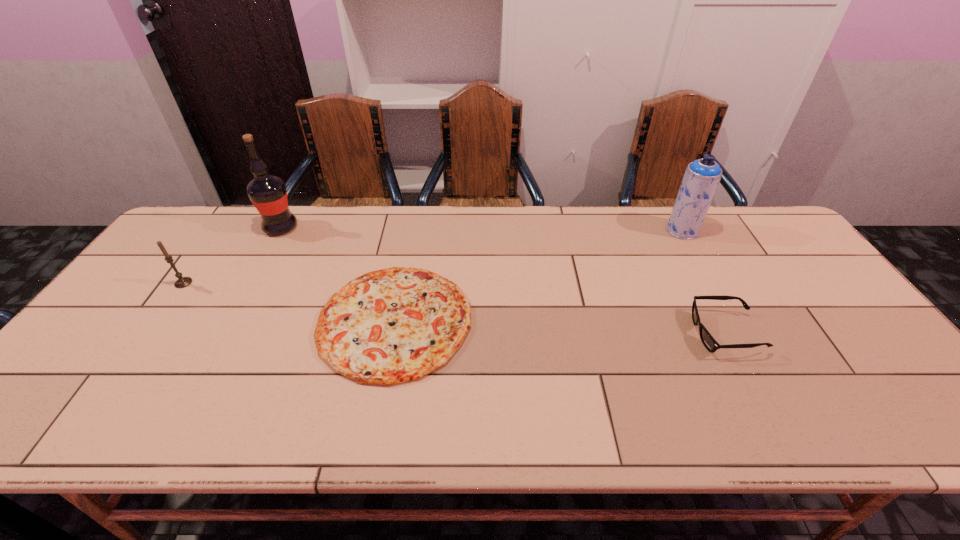
Where is `empty space that is in between the aerosol can and the sunglasses`? This screenshot has width=960, height=540. empty space that is in between the aerosol can and the sunglasses is located at coordinates (704, 282).

Where is `blank region between the tallest object and the fourth shortest object`? The image size is (960, 540). blank region between the tallest object and the fourth shortest object is located at coordinates (481, 229).

At what (x,y) coordinates should I click in order to perform the action: click on empty space that is in between the sunglasses and the aerosol can. Please return your answer as a coordinate pair (x, y). Looking at the image, I should click on (704, 282).

You are a GUI agent. You are given a task and a screenshot of the screen. Output one action in this format:
    pyautogui.click(x=<x>, y=<y>)
    Task: Click on the object that stands as the closest to the tallest object
    Image resolution: width=960 pixels, height=540 pixels.
    Given the screenshot: What is the action you would take?
    pyautogui.click(x=182, y=282)

Choose which object is the third nearest neighbor to the leftmost object. Please provide its 2D coordinates. Your answer should be formatted as a tuple, i.e. [(x, y)], where the tuple contains the x and y coordinates of a point satisfying the conditions above.

[(709, 342)]

The image size is (960, 540). Find the location of `vacant space that satisfies the following two spatial constraints: 1. on the front side of the shortest object; 2. on the right side of the tallest object`. vacant space that satisfies the following two spatial constraints: 1. on the front side of the shortest object; 2. on the right side of the tallest object is located at coordinates (229, 321).